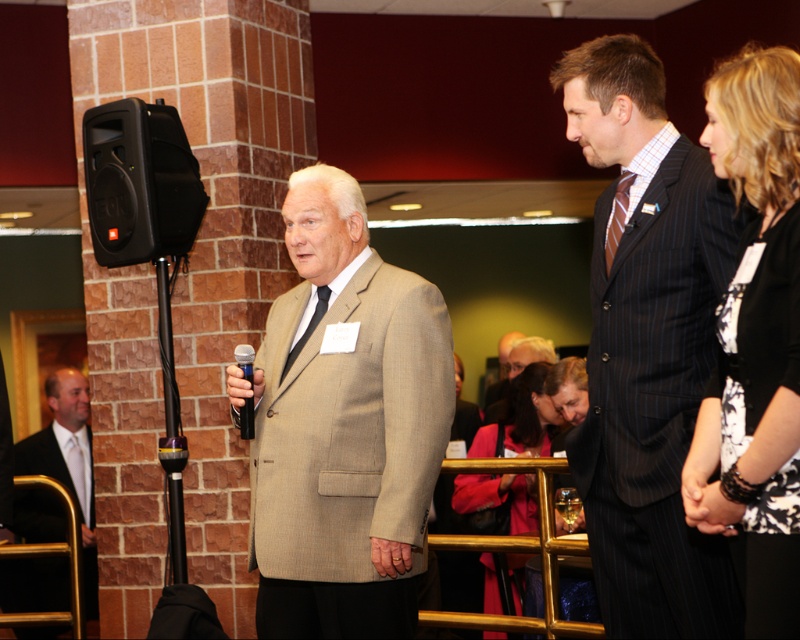
From the picture: Which is more to the right, black plastic speaker at left or matte pink coat at center?

Positioned to the right is matte pink coat at center.

Looking at this image, who is higher up, black plastic speaker at left or matte pink coat at center?

black plastic speaker at left is higher up.

Is point (145, 152) positioned behind point (470, 476)?

That is False.

Locate an element on the screen. black plastic speaker at left is located at coordinates (140, 182).

In order to click on striped silk tie at center in this screenshot , I will do `click(617, 216)`.

Who is more forward, (616, 192) or (324, 284)?

Point (616, 192)

Where is `striped silk tie at center`? The width and height of the screenshot is (800, 640). striped silk tie at center is located at coordinates (617, 216).

You are a GUI agent. You are given a task and a screenshot of the screen. Output one action in this format:
    pyautogui.click(x=<x>, y=<y>)
    Task: Click on the striped silk tie at center
    The width and height of the screenshot is (800, 640).
    Given the screenshot: What is the action you would take?
    pyautogui.click(x=617, y=216)

Which is in front, point (140, 230) or point (624, 192)?

Point (624, 192) is more forward.

Is black plastic speaker at left below striped silk tie at center?

No.

The width and height of the screenshot is (800, 640). Describe the element at coordinates (140, 182) in the screenshot. I see `black plastic speaker at left` at that location.

The width and height of the screenshot is (800, 640). In order to click on black plastic speaker at left in this screenshot , I will do `click(140, 182)`.